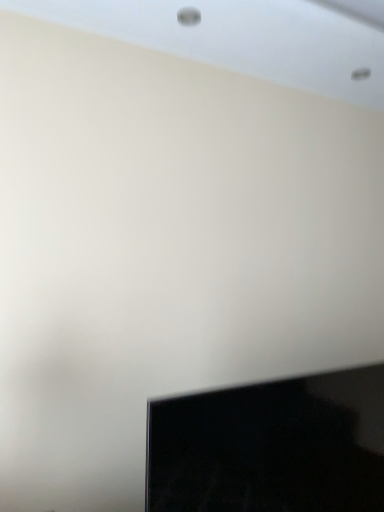
The width and height of the screenshot is (384, 512). What do you see at coordinates (271, 446) in the screenshot? I see `black glossy tv at lower right` at bounding box center [271, 446].

Identify the location of black glossy tv at lower right. (271, 446).

You are a GUI agent. You are given a task and a screenshot of the screen. Output one action in this format:
    pyautogui.click(x=<x>, y=<y>)
    Task: Click on the black glossy tv at lower right
    
    Given the screenshot: What is the action you would take?
    pyautogui.click(x=271, y=446)